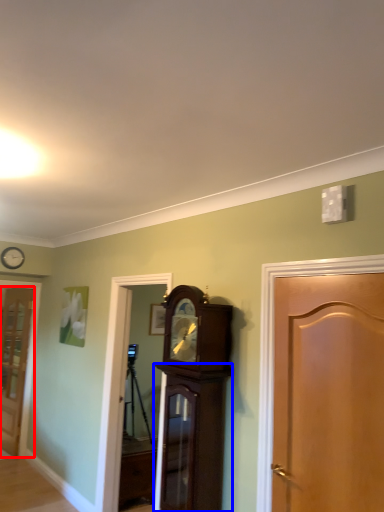
Question: Among these objects, which one is nearest to the camera, door (highlighted by a red box) or cabinetry (highlighted by a blue box)?

Choices:
 (A) door
 (B) cabinetry

Answer: (B)